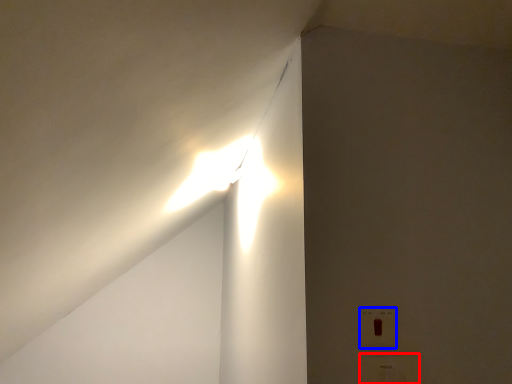
Question: Which point is further to the camera, electric outlet (highlighted by a red box) or electric outlet (highlighted by a blue box)?

Choices:
 (A) electric outlet
 (B) electric outlet

Answer: (B)